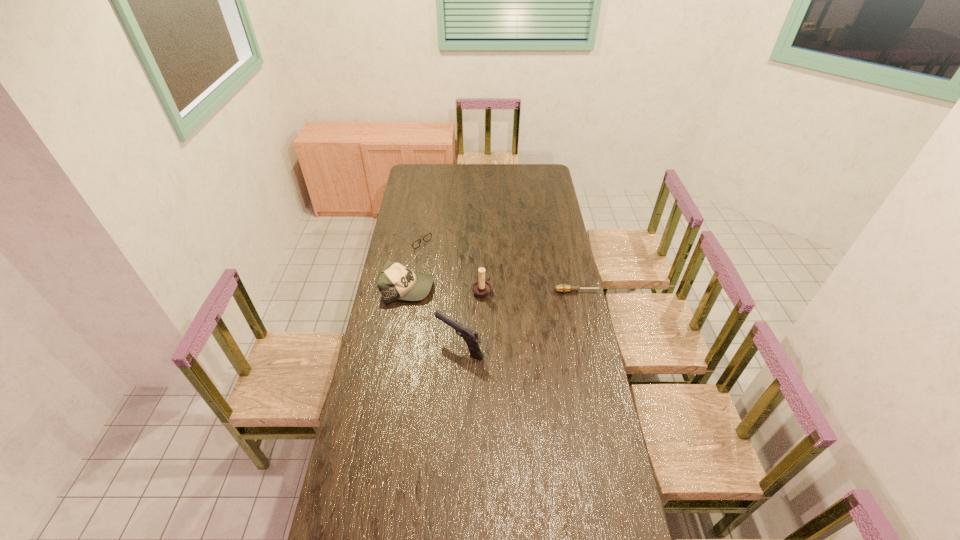
You are a GUI agent. You are given a task and a screenshot of the screen. Output one action in this format:
    pyautogui.click(x=<x>, y=<y>)
    Task: Click on the free spot on the desktop that is between the gun and the screwdriver and is positioned on the front-facing side of the third tallest object
    The image size is (960, 540).
    Given the screenshot: What is the action you would take?
    pyautogui.click(x=533, y=312)

Locate an element on the screen. vacant space on the desktop that is between the nearest object and the screwdriver and is positioned on the front-facing side of the sunglasses is located at coordinates (525, 315).

You are a GUI agent. You are given a task and a screenshot of the screen. Output one action in this format:
    pyautogui.click(x=<x>, y=<y>)
    Task: Click on the vacant space on the desktop that is between the gun and the rightmost object and is positioned on the wick of the candle holder
    
    Given the screenshot: What is the action you would take?
    pyautogui.click(x=534, y=312)